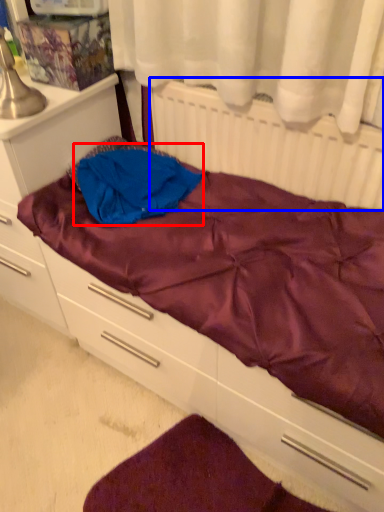
Question: Which object appears closest to the camera in this image, clothing (highlighted by a red box) or radiator (highlighted by a blue box)?

Choices:
 (A) clothing
 (B) radiator

Answer: (B)